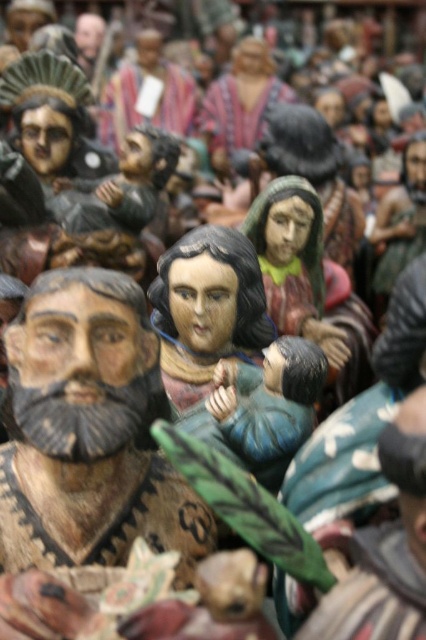
Is wooden statue at center positioned behind wooden figure at center?

Yes, wooden statue at center is further from the viewer.

Is point (190, 362) behind point (201, 515)?

Yes, it is.

Where is `wooden statue at center`? This screenshot has width=426, height=640. wooden statue at center is located at coordinates (207, 308).